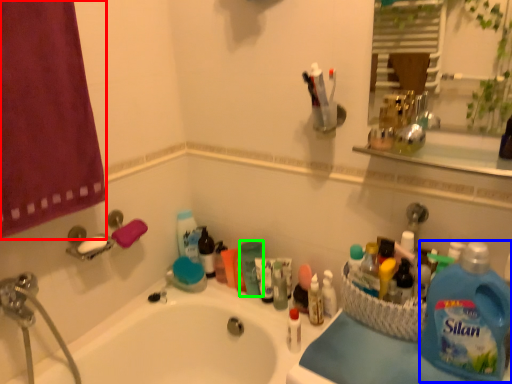
Question: Which object is positioned farthest from shower curtain (highlighted by a red box)? Select from cleaning product (highlighted by a blue box) and cleaning product (highlighted by a green box).

Choices:
 (A) cleaning product
 (B) cleaning product

Answer: (A)